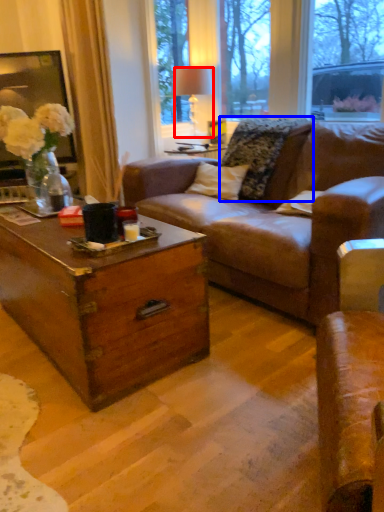
Question: Which point is further to the camera, lamp (highlighted by a red box) or pillow (highlighted by a blue box)?

Choices:
 (A) lamp
 (B) pillow

Answer: (A)